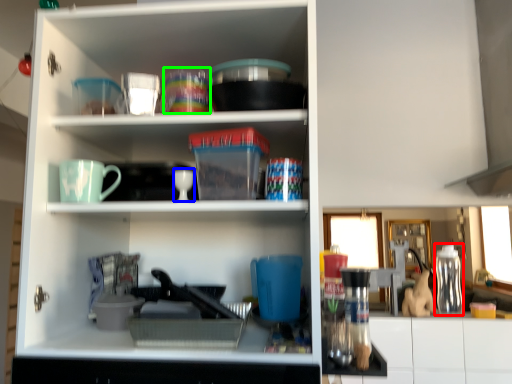
Question: Estimate the real-world distances between objects in this image. Which object is farther from bottle (highlighted by a red box), tableware (highlighted by a blue box) or tableware (highlighted by a green box)?

Choices:
 (A) tableware
 (B) tableware

Answer: (B)